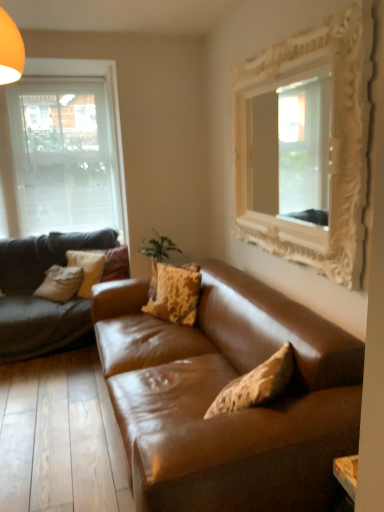
Question: From a real-world perspective, is transparent glass window at left on camouflage-patterned fabric pillow at center-left, the second pillow from the front?

Choices:
 (A) no
 (B) yes

Answer: (B)

Question: Is transparent glass window at left beside camouflage-patterned fabric pillow at center-left, the 3th pillow positioned from the right?

Choices:
 (A) yes
 (B) no

Answer: (B)

Question: Is the position of transparent glass window at left less distant than that of camouflage-patterned fabric pillow at center-left, the second pillow from the front?

Choices:
 (A) yes
 (B) no

Answer: (B)

Question: Does transparent glass window at left have a lesser height compared to camouflage-patterned fabric pillow at center-left, the second pillow from the front?

Choices:
 (A) no
 (B) yes

Answer: (A)

Question: Can you confirm if transparent glass window at left is taller than camouflage-patterned fabric pillow at center-left, the 3th pillow positioned from the right?

Choices:
 (A) no
 (B) yes

Answer: (B)

Question: Does transparent glass window at left have a greater width compared to camouflage-patterned fabric pillow at center-left, the 3th pillow positioned from the right?

Choices:
 (A) no
 (B) yes

Answer: (A)

Question: Is camouflage-patterned fabric pillow at center, which appears as the 2th pillow when viewed from the right, oriented away from white ornate mirror at upper right?

Choices:
 (A) no
 (B) yes

Answer: (A)

Question: Considering the relative sizes of camouflage-patterned fabric pillow at center, marked as the third pillow in a front-to-back arrangement, and white ornate mirror at upper right in the image provided, is camouflage-patterned fabric pillow at center, marked as the third pillow in a front-to-back arrangement, thinner than white ornate mirror at upper right?

Choices:
 (A) no
 (B) yes

Answer: (A)

Question: From a real-world perspective, is camouflage-patterned fabric pillow at center, which appears as the 2th pillow when viewed from the right, located higher than white ornate mirror at upper right?

Choices:
 (A) yes
 (B) no

Answer: (B)

Question: Can you confirm if camouflage-patterned fabric pillow at center, acting as the first pillow starting from the back, is bigger than white ornate mirror at upper right?

Choices:
 (A) no
 (B) yes

Answer: (A)

Question: Is camouflage-patterned fabric pillow at center, which appears as the 2th pillow when viewed from the right, positioned far away from white ornate mirror at upper right?

Choices:
 (A) yes
 (B) no

Answer: (A)

Question: Can you confirm if camouflage-patterned fabric pillow at center, which appears as the 2th pillow when viewed from the right, is smaller than white ornate mirror at upper right?

Choices:
 (A) no
 (B) yes

Answer: (B)

Question: Considering the relative sizes of camouflage-patterned fabric pillow at center, acting as the third pillow starting from the back, and camouflage-patterned fabric pillow at center, marked as the third pillow in a front-to-back arrangement, in the image provided, is camouflage-patterned fabric pillow at center, acting as the third pillow starting from the back, shorter than camouflage-patterned fabric pillow at center, marked as the third pillow in a front-to-back arrangement,?

Choices:
 (A) yes
 (B) no

Answer: (B)